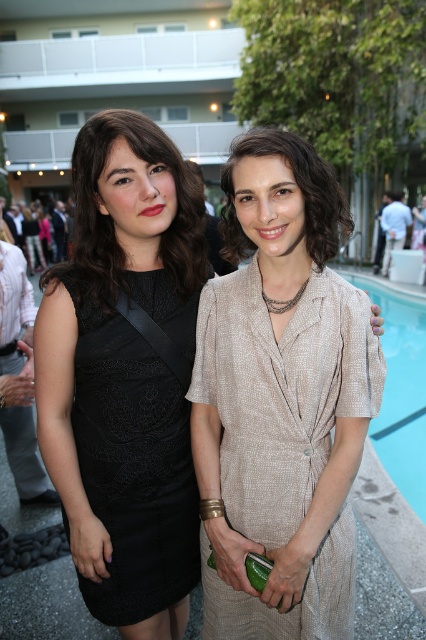
You are standing at the origin point of the coordinate system. There is a black lace dress at left located at point (132, 461). Can you tell me the coordinates of the black lace dress at left?

The coordinates of the black lace dress at left are point (132, 461).

You are organizing a photoshoot and need to ensure that the black lace dress at left and the blue smooth water at lower right are both visible in the frame. Based on their sizes, which object should you prioritize keeping centered to avoid cropping?

→ The blue smooth water at lower right should be prioritized as it occupies more space than the black lace dress at left, so keeping it centered would ensure it fits better in the frame.